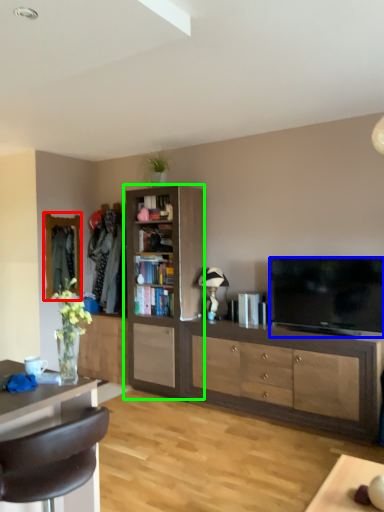
Question: Considering the real-world distances, which object is farthest from mirror (highlighted by a red box)? television (highlighted by a blue box) or cabinetry (highlighted by a green box)?

Choices:
 (A) television
 (B) cabinetry

Answer: (A)